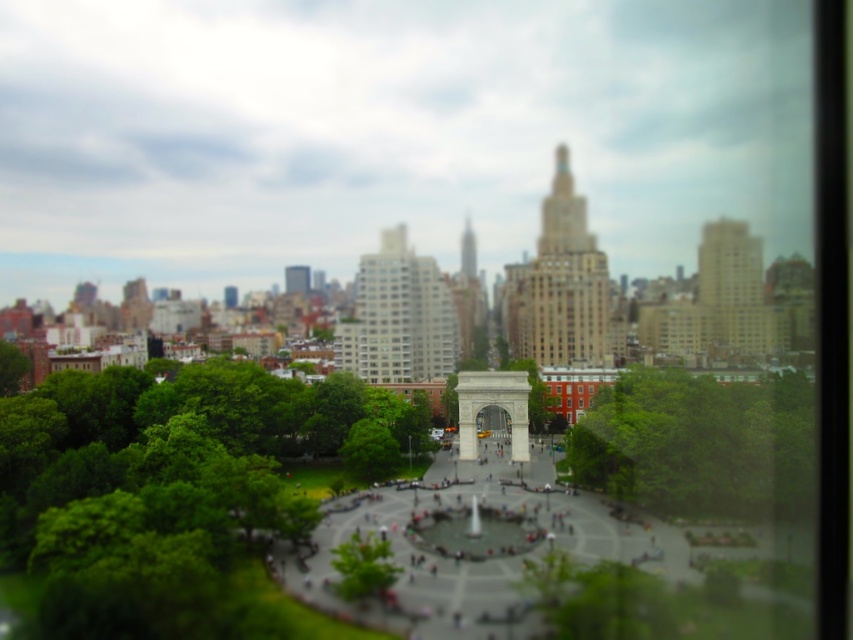
You are a photographer planning to capture a wide shot of the cityscape with both the green leafy tree at lower left and the green leafy tree at center in the frame. Which tree should you position closer to the edge of the frame to maintain their natural sizes in the photo?

You should position the green leafy tree at center closer to the edge of the frame because the green leafy tree at lower left is wider than the green leafy tree at center. This way, both trees will appear proportionally sized in the photo.